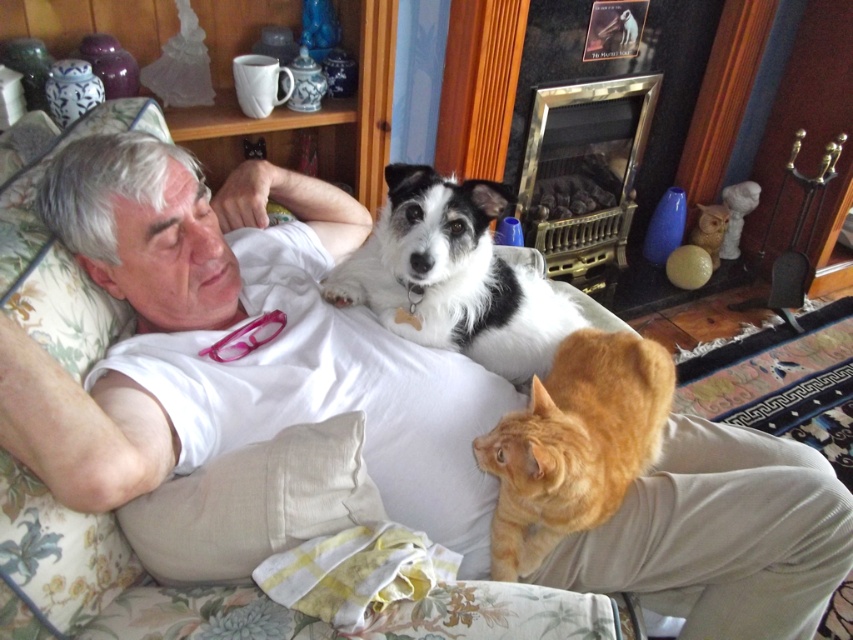
Is orange fur cat at lower right positioned behind gold brass fireplace at center?

No, it is not.

Between orange fur cat at lower right and gold brass fireplace at center, which one is positioned higher?

Positioned higher is gold brass fireplace at center.

The image size is (853, 640). Describe the element at coordinates (573, 444) in the screenshot. I see `orange fur cat at lower right` at that location.

At what (x,y) coordinates should I click in order to perform the action: click on orange fur cat at lower right. Please return your answer as a coordinate pair (x, y). The height and width of the screenshot is (640, 853). Looking at the image, I should click on pos(573,444).

The height and width of the screenshot is (640, 853). In order to click on white fluffy dog at upper center in this screenshot , I will do `click(453, 276)`.

Which of these two, white fluffy dog at upper center or gold brass fireplace at center, stands shorter?

With less height is white fluffy dog at upper center.

Identify the location of white fluffy dog at upper center. The image size is (853, 640). (453, 276).

At what (x,y) coordinates should I click in order to perform the action: click on white fluffy dog at upper center. Please return your answer as a coordinate pair (x, y). The image size is (853, 640). Looking at the image, I should click on (453, 276).

Does white fluffy dog at upper center appear on the left side of orange fur cat at lower right?

Indeed, white fluffy dog at upper center is positioned on the left side of orange fur cat at lower right.

Between point (514, 348) and point (575, 364), which one is positioned behind?

The point (514, 348) is more distant.

Where is `white fluffy dog at upper center`? The image size is (853, 640). white fluffy dog at upper center is located at coordinates (453, 276).